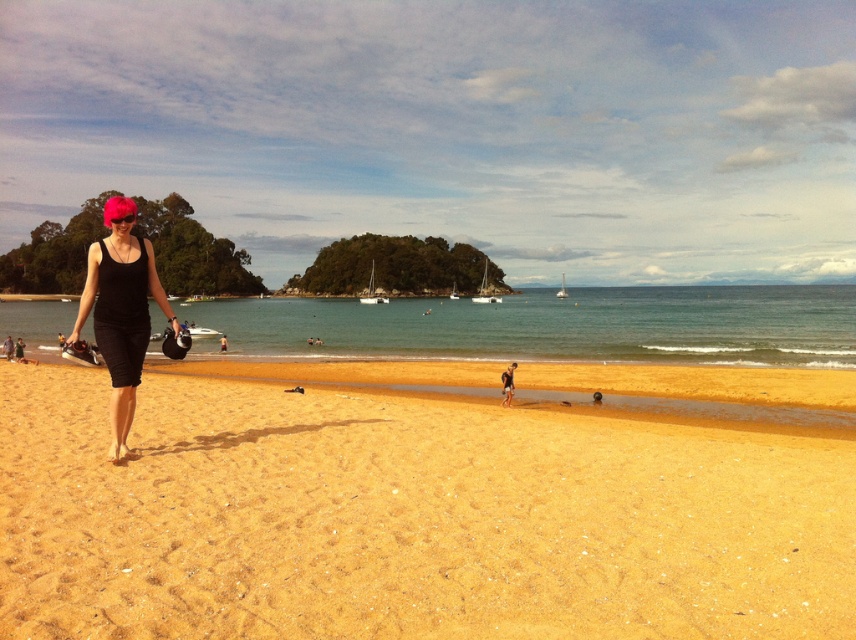
You are a swimmer wanting to enter the water. You see the clear blue water at center and the black matte swimsuit at left. Which direction should you move to reach the water first?

The clear blue water at center is positioned over the black matte swimsuit at left, meaning it is closer to the observer. Therefore, you should move towards the center to reach the water first.